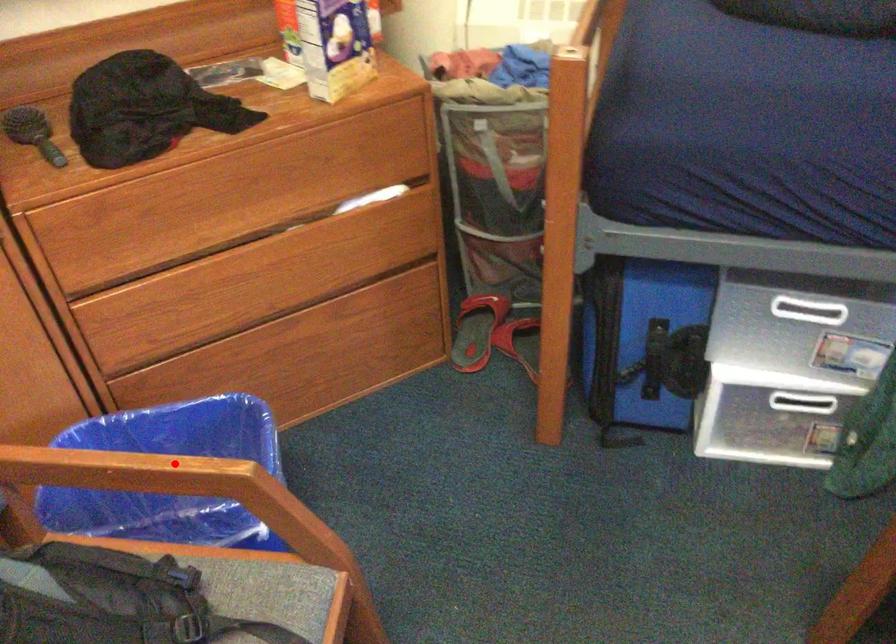
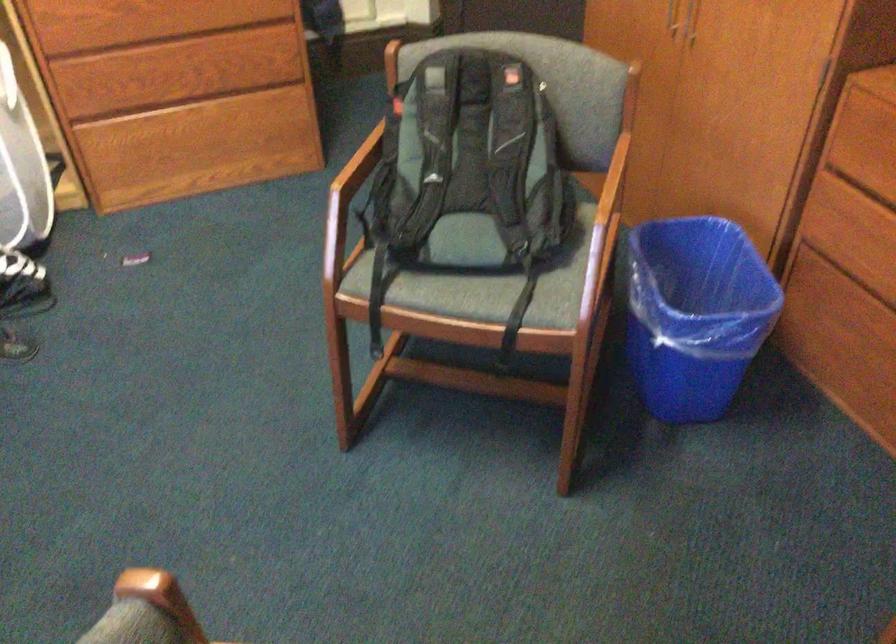
Question: I am providing you with two images of the same scene from different viewpoints. A red point is marked on the first image. Can you still see the location of the red point in image 2?

Choices:
 (A) Yes
 (B) No

Answer: (A)